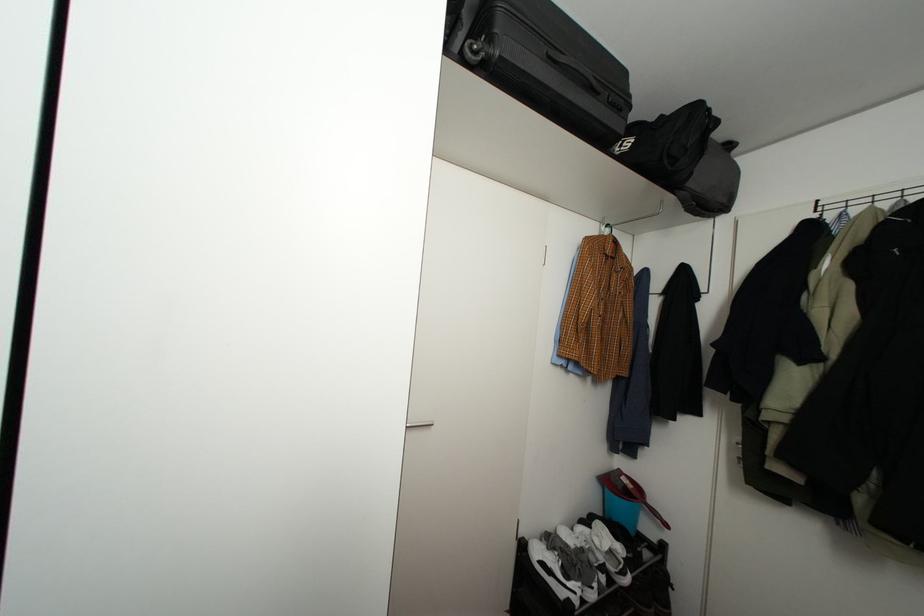
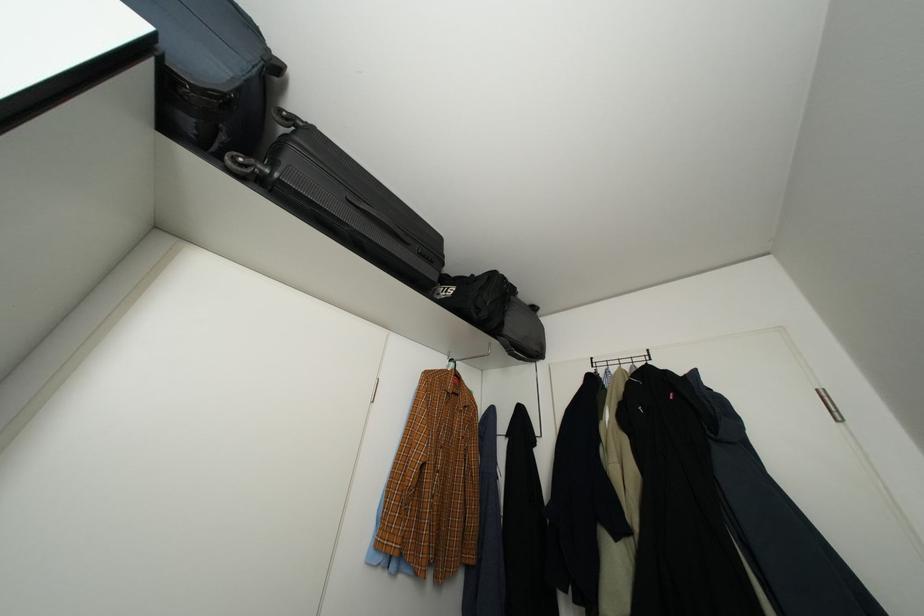
Where in the second image is the point corresponding to pixel 604 236 from the first image?

(451, 369)